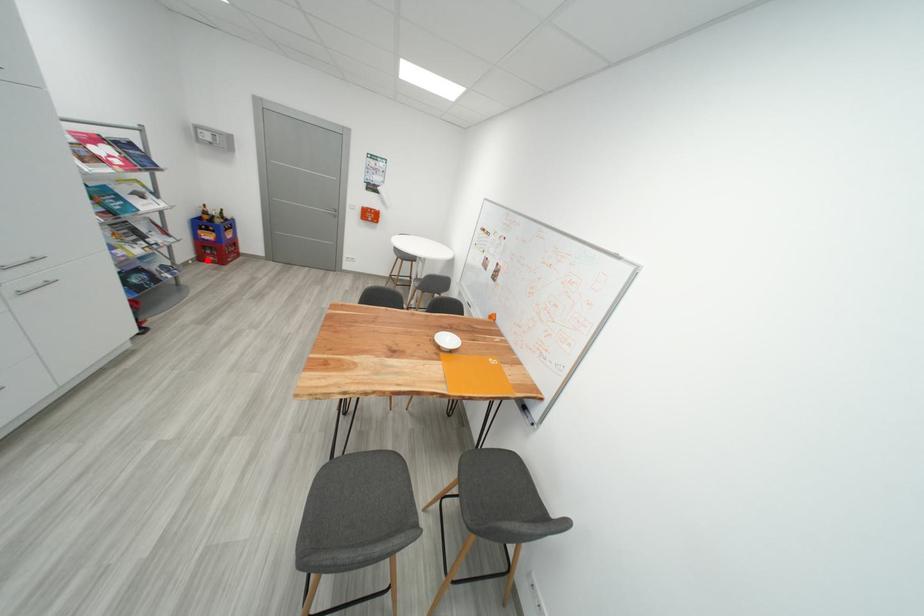
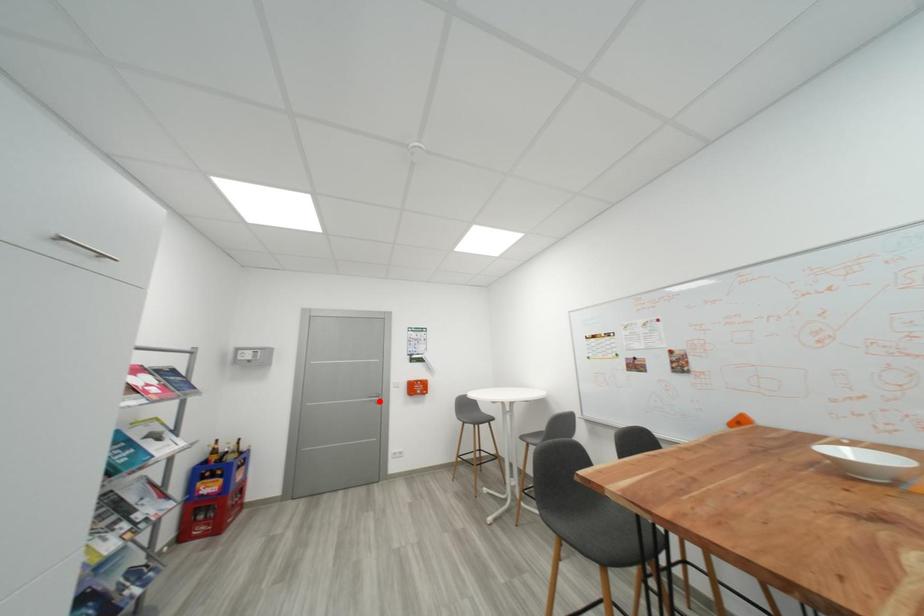
I am providing you with two images of the same scene from different viewpoints. A red point is marked on the first image and another point is marked on the second image. Does the point marked in image1 correspond to the same location as the one in image2?

No